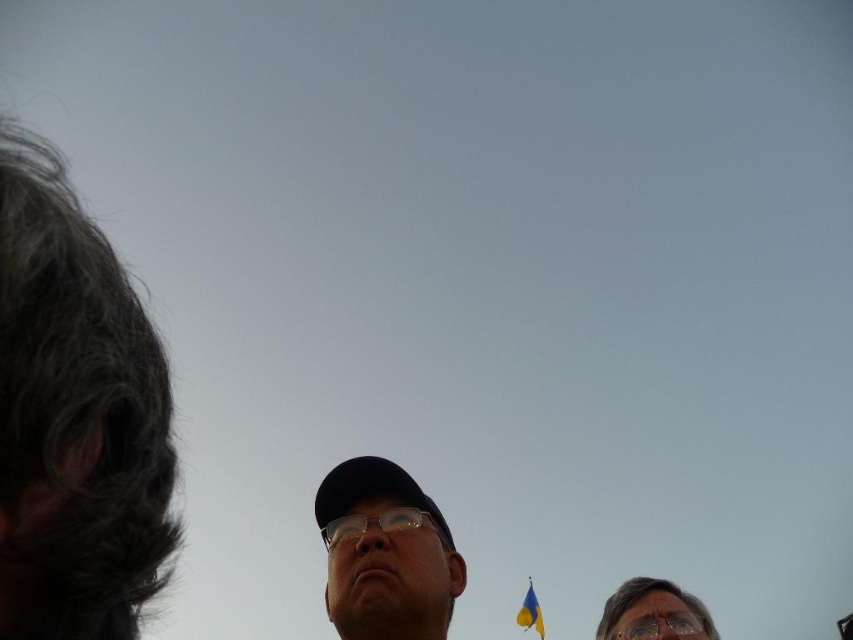
Question: Is the position of matte black cap at center less distant than that of yellowpolyester fabricflag at lower center?

Choices:
 (A) yes
 (B) no

Answer: (A)

Question: Among these objects, which one is farthest from the camera?

Choices:
 (A) transparent plastic glasses at center
 (B) transparent plastic goggles at lower center
 (C) gray hair at left

Answer: (A)

Question: Does clear plastic glasses at lower right appear on the right side of yellowpolyester fabricflag at lower center?

Choices:
 (A) yes
 (B) no

Answer: (A)

Question: Which point is farther from the camera taking this photo?

Choices:
 (A) (695, 625)
 (B) (405, 515)

Answer: (B)

Question: Among these points, which one is nearest to the camera?

Choices:
 (A) (115, 364)
 (B) (419, 509)
 (C) (679, 636)

Answer: (A)

Question: Observing the image, what is the correct spatial positioning of matte black cap at center in reference to yellowpolyester fabricflag at lower center?

Choices:
 (A) above
 (B) below

Answer: (A)